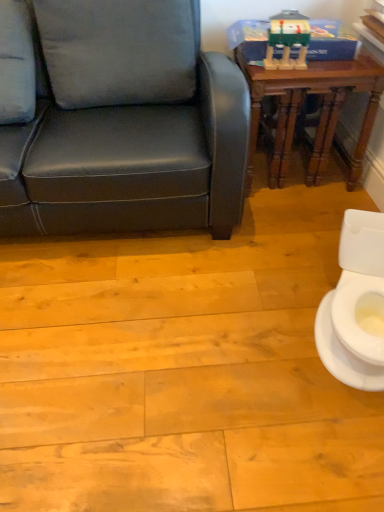
I want to click on free point below wooden table at upper right (from a real-world perspective), so click(x=281, y=169).